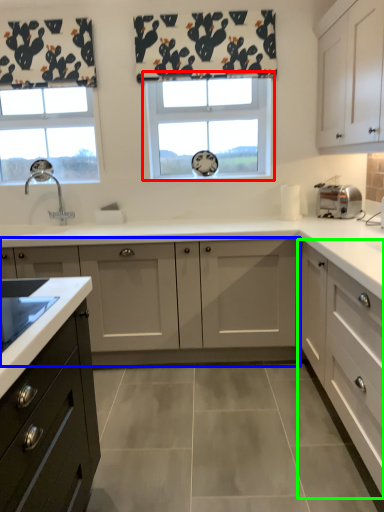
Question: Which is farther away from window (highlighted by a red box)? cabinetry (highlighted by a blue box) or cabinetry (highlighted by a green box)?

Choices:
 (A) cabinetry
 (B) cabinetry

Answer: (B)